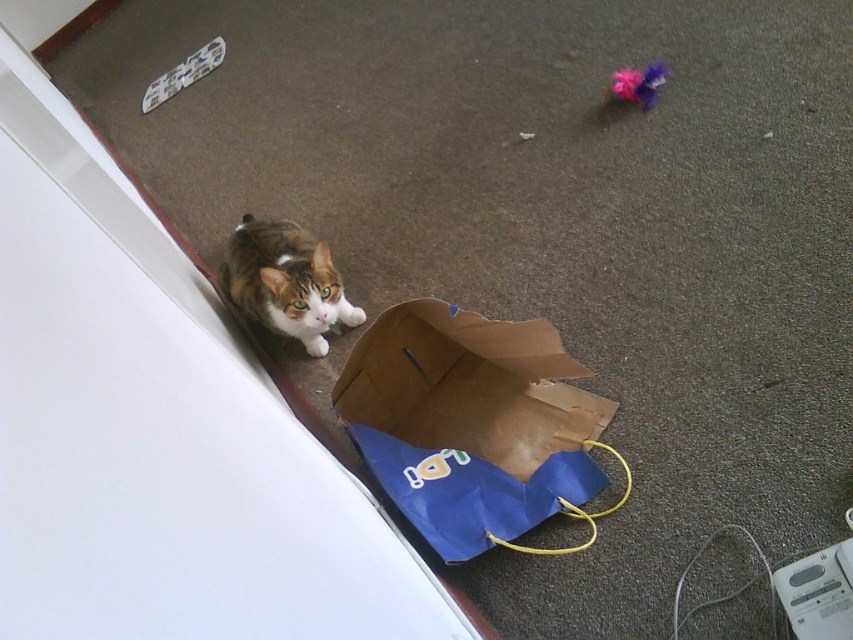
You are a robotic vacuum cleaner with a 100 cm wide path requirement. You need to move from the brown paper bag at center to the fuzzy fabric toy at upper right. Can you navigate the path between them?

The brown paper bag at center is 99.10 centimeters from fuzzy fabric toy at upper right. Since the distance is less than your 100 cm requirement, the path is too narrow for the robotic vacuum cleaner to pass through.

You are a photographer trying to capture a closeup of the tabby fur cat at center and the fuzzy fabric toy at upper right. Which one will appear larger in the photo?

The tabby fur cat at center will appear larger in the photo because it is much taller than the fuzzy fabric toy at upper right.